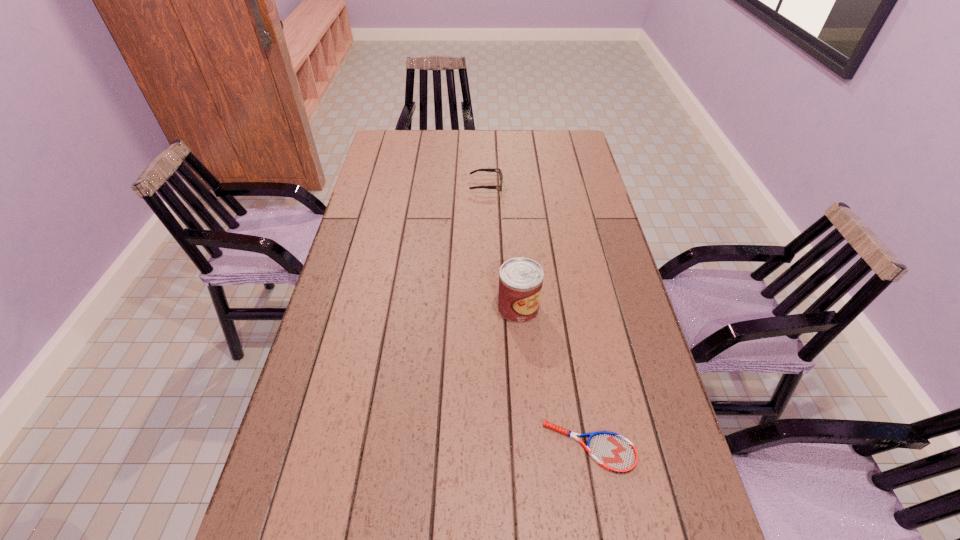
What are the coordinates of `vacant space that satisfies the following two spatial constraints: 1. on the front side of the second nearest object; 2. on the right side of the tennis racket` in the screenshot? It's located at (529, 447).

Identify the location of free space that satisfies the following two spatial constraints: 1. on the front-facing side of the second shortest object; 2. on the back side of the tallest object. point(488,308).

Locate an element on the screen. vacant area that satisfies the following two spatial constraints: 1. on the front-facing side of the farthest object; 2. on the back side of the tallest object is located at coordinates (488, 308).

What are the coordinates of `vacant region that satisfies the following two spatial constraints: 1. on the front-facing side of the sunglasses; 2. on the back side of the second farthest object` in the screenshot? It's located at (488, 308).

This screenshot has height=540, width=960. In order to click on vacant space that satisfies the following two spatial constraints: 1. on the back side of the tennis racket; 2. on the front-facing side of the second shortest object in this screenshot , I will do `click(543, 185)`.

This screenshot has height=540, width=960. Find the location of `free space that satisfies the following two spatial constraints: 1. on the front-facing side of the shortest object; 2. on the right side of the sunglasses`. free space that satisfies the following two spatial constraints: 1. on the front-facing side of the shortest object; 2. on the right side of the sunglasses is located at coordinates (491, 447).

You are a GUI agent. You are given a task and a screenshot of the screen. Output one action in this format:
    pyautogui.click(x=<x>, y=<y>)
    Task: Click on the free space that satisfies the following two spatial constraints: 1. on the back side of the can; 2. on the front-facing side of the second tallest object
    The height and width of the screenshot is (540, 960).
    Given the screenshot: What is the action you would take?
    pyautogui.click(x=509, y=185)

Where is `free space in the image that satisfies the following two spatial constraints: 1. on the front side of the tennis racket; 2. on the right side of the can`? free space in the image that satisfies the following two spatial constraints: 1. on the front side of the tennis racket; 2. on the right side of the can is located at coordinates (529, 447).